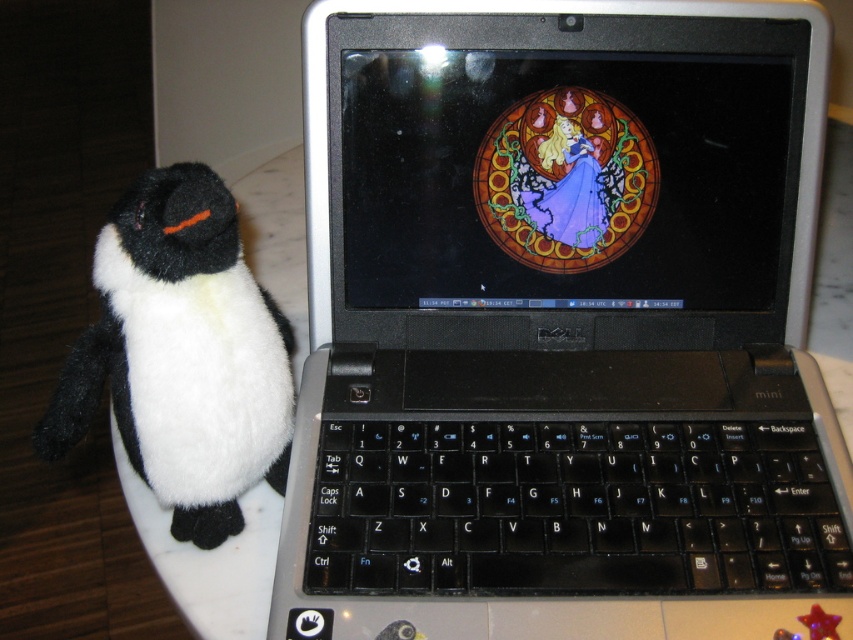
Is point (434, 74) farther from viewer compared to point (181, 234)?

Yes.

Does black plastic laptop at center have a greater width compared to black plush penguin at left?

Correct, the width of black plastic laptop at center exceeds that of black plush penguin at left.

Which is in front, point (664, 60) or point (229, 321)?

Point (229, 321)

Image resolution: width=853 pixels, height=640 pixels. What are the coordinates of `black plastic laptop at center` in the screenshot? It's located at (552, 310).

Does black plastic keyboard at center have a greater height compared to black plush penguin at left?

Incorrect, black plastic keyboard at center's height is not larger of black plush penguin at left's.

I want to click on black plastic keyboard at center, so click(573, 509).

Is point (310, 556) closer to viewer compared to point (219, 198)?

No, it is not.

Image resolution: width=853 pixels, height=640 pixels. What are the coordinates of `black plastic keyboard at center` in the screenshot? It's located at (573, 509).

Who is taller, black plastic laptop at center or black plastic keyboard at center?

black plastic laptop at center is taller.

Can you confirm if black plastic laptop at center is positioned below black plastic keyboard at center?

Incorrect, black plastic laptop at center is not positioned below black plastic keyboard at center.

The image size is (853, 640). What do you see at coordinates (552, 310) in the screenshot?
I see `black plastic laptop at center` at bounding box center [552, 310].

The width and height of the screenshot is (853, 640). I want to click on black plastic laptop at center, so click(552, 310).